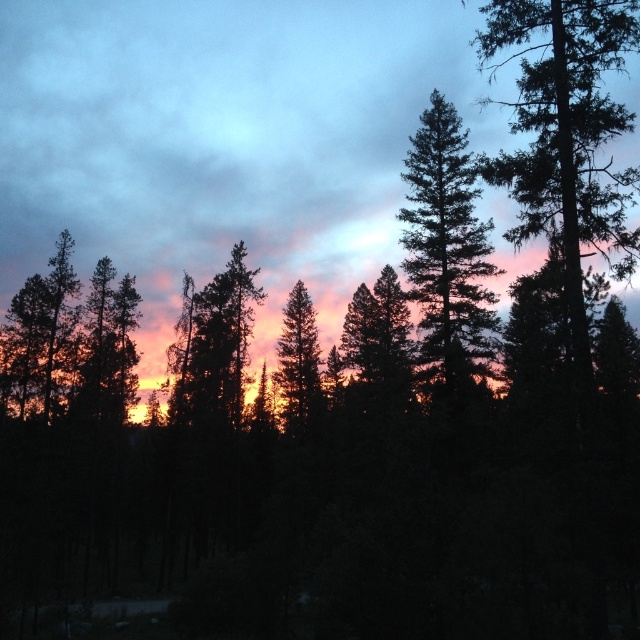
You are a photographer standing in a forest and see the green textured tree at upper right in your camera viewfinder. You want to take a photo of it but need to be at least 16 meters away to avoid blurring the background. Should you move closer or farther away?

The green textured tree at upper right is currently 15.61 meters away from the camera. Since you need to be at least 16 meters away to avoid background blur, you should move slightly farther away from the tree.

You are an artist sketching this scene and want to add details to the green textured tree at upper right and silhouette pine tree at center. Which tree should you draw first to maintain proper perspective?

You should draw the green textured tree at upper right first because it is closer to the viewer than the silhouette pine tree at center, so it should be placed in front in your sketch.